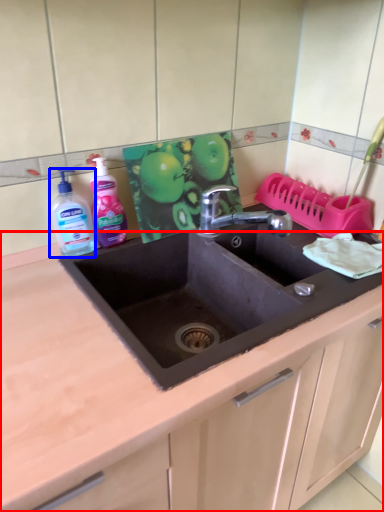
Question: Among these objects, which one is nearest to the camera, countertop (highlighted by a red box) or cleaning product (highlighted by a blue box)?

Choices:
 (A) countertop
 (B) cleaning product

Answer: (A)